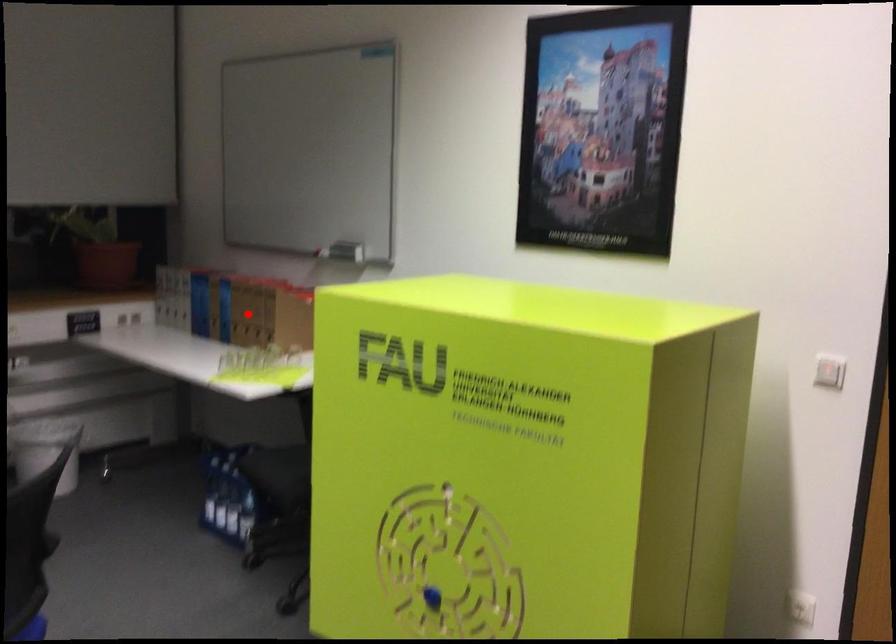
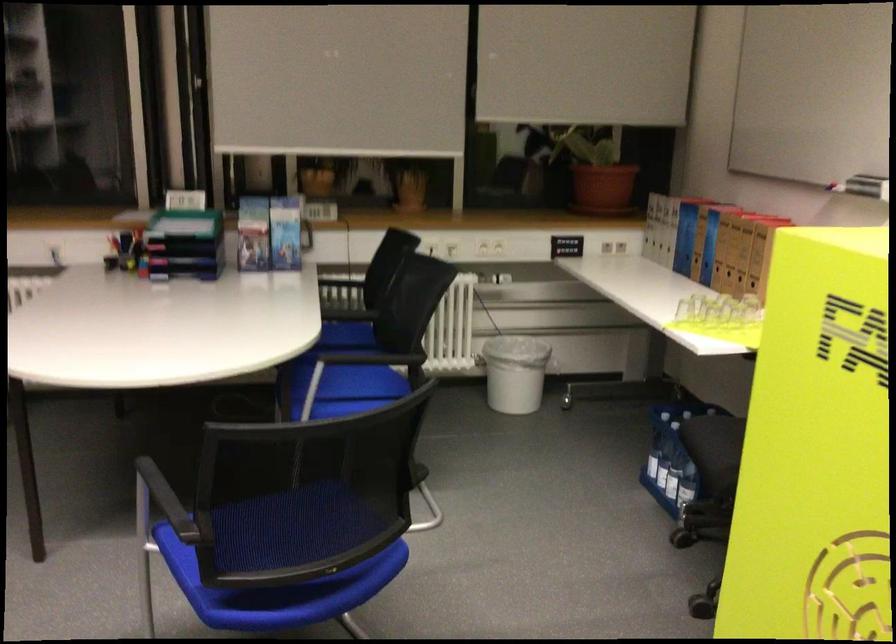
Locate, in the second image, the point that corresponds to the highlighted location in the first image.

(730, 251)